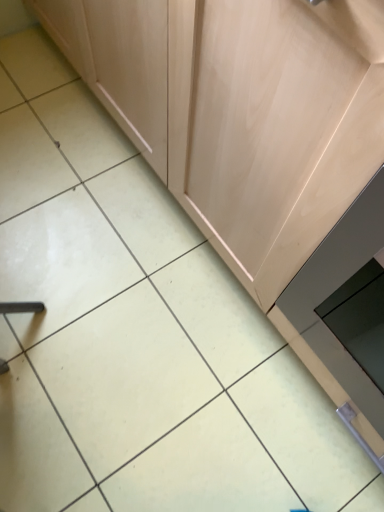
What do you see at coordinates (331, 293) in the screenshot?
I see `matte wood oven at lower right` at bounding box center [331, 293].

This screenshot has height=512, width=384. I want to click on matte wood oven at lower right, so click(x=331, y=293).

Find the location of a particular element. This screenshot has width=384, height=512. matte wood oven at lower right is located at coordinates (331, 293).